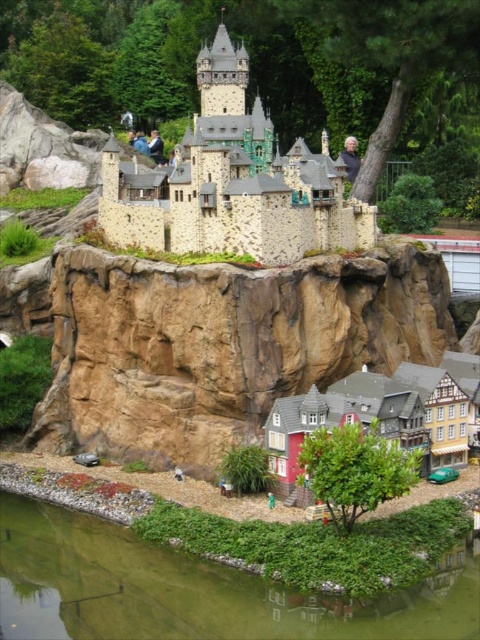
Question: Is brown rock cliff at lower center smaller than green liquid water at lower center?

Choices:
 (A) no
 (B) yes

Answer: (A)

Question: Which of the following is the farthest from the observer?

Choices:
 (A) stone brick castle at upper center
 (B) green liquid water at lower center

Answer: (A)

Question: Is brown rock cliff at lower center smaller than green liquid water at lower center?

Choices:
 (A) no
 (B) yes

Answer: (A)

Question: Among these points, which one is nearest to the camera?

Choices:
 (A) (171, 570)
 (B) (392, 262)

Answer: (A)

Question: Is brown rock cliff at lower center above green liquid water at lower center?

Choices:
 (A) no
 (B) yes

Answer: (B)

Question: Based on their relative distances, which object is farther from the green liquid water at lower center?

Choices:
 (A) brown rock cliff at lower center
 (B) stone brick castle at upper center

Answer: (B)